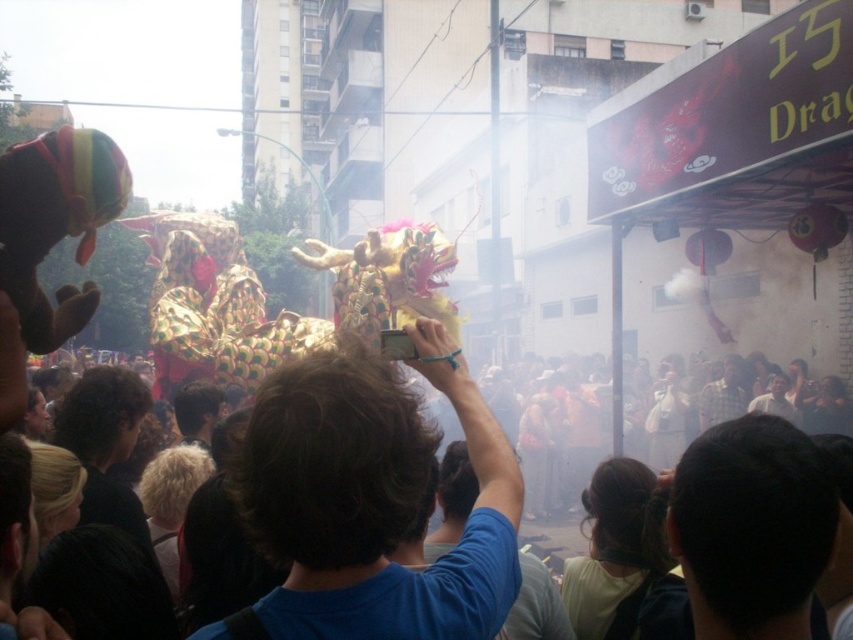
You are a photographer at the event and want to capture both the dark brown hair at center and the plaid fabric shirt at center in the same frame. Which object should you focus on first to ensure both are in the frame?

The dark brown hair at center is much taller than the plaid fabric shirt at center, so you should focus on the dark brown hair at center first to ensure both are in the frame.

You are a photographer trying to capture the dragon in the center. You notice a person with a blue fabric shirt at center and another with dark brown hair at center. Which of these two people is positioned to the right side of the other?

The blue fabric shirt at center is to the right of dark brown hair at center, so the person with the blue fabric shirt at center is positioned to the right of the person with dark brown hair at center.